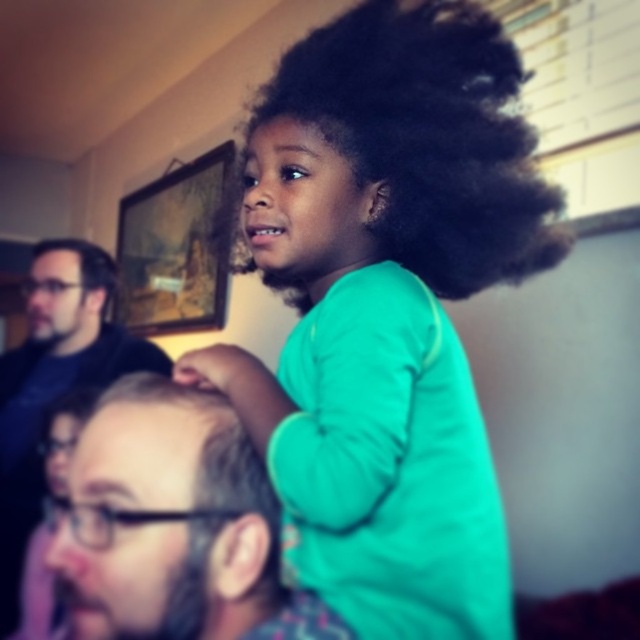
Between point (292, 628) and point (77, 237), which one is positioned in front?

Point (292, 628) is more forward.

Is the position of matte black hair at upper center less distant than that of dark brown curly hair at left?

Yes.

Locate an element on the screen. This screenshot has height=640, width=640. matte black hair at upper center is located at coordinates (173, 524).

Locate an element on the screen. The height and width of the screenshot is (640, 640). matte black hair at upper center is located at coordinates (173, 524).

In the scene shown: Does black curly hair at upper center have a lesser height compared to matte black hair at upper center?

Incorrect, black curly hair at upper center's height does not fall short of matte black hair at upper center's.

Which is in front, point (376, 35) or point (227, 492)?

Point (227, 492) is in front.

In the scene shown: Who is more distant from viewer, (x=432, y=209) or (x=100, y=401)?

Point (x=432, y=209)

This screenshot has width=640, height=640. In order to click on black curly hair at upper center in this screenshot , I will do point(428,136).

Is black curly hair at upper center bigger than wooden framed artwork at upper left?

No.

Is black curly hair at upper center closer to the viewer compared to wooden framed artwork at upper left?

Yes, it is in front of wooden framed artwork at upper left.

Is point (518, 253) behind point (195, 230)?

No, (518, 253) is in front of (195, 230).

Identify the location of black curly hair at upper center. The width and height of the screenshot is (640, 640). (428, 136).